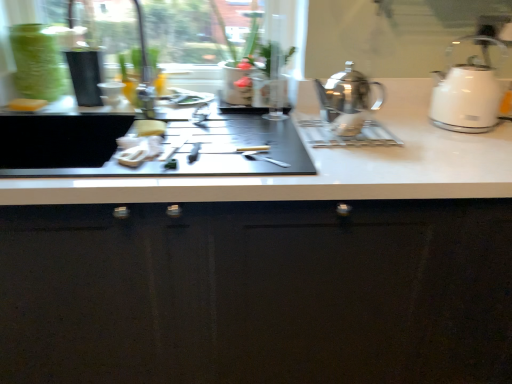
The height and width of the screenshot is (384, 512). Describe the element at coordinates (467, 92) in the screenshot. I see `white glossy kettle at right, which is the second kettle in left-to-right order` at that location.

The height and width of the screenshot is (384, 512). I want to click on shiny metallic kettle at center, which appears as the first kettle when viewed from the left, so click(347, 100).

The height and width of the screenshot is (384, 512). I want to click on glossy black cabinet at center, so click(257, 293).

You are a GUI agent. You are given a task and a screenshot of the screen. Output one action in this format:
    pyautogui.click(x=<x>, y=<y>)
    Task: Click on the white matte sponge at left, which is the 1th food in left-to-right order
    This screenshot has height=384, width=512.
    Given the screenshot: What is the action you would take?
    click(x=26, y=104)

Between point (479, 209) and point (19, 104), which one is positioned behind?

Positioned behind is point (19, 104).

Considering the relative sizes of glossy black cabinet at center and white matte sponge at left, which is counted as the first food, starting from the top, in the image provided, is glossy black cabinet at center thinner than white matte sponge at left, which is counted as the first food, starting from the top,?

No, glossy black cabinet at center is not thinner than white matte sponge at left, which is counted as the first food, starting from the top.

Is glossy black cabinet at center directly adjacent to white matte sponge at left, which is counted as the first food, starting from the top?

No, glossy black cabinet at center is not touching white matte sponge at left, which is counted as the first food, starting from the top.

Which is more to the right, glossy black cabinet at center or white matte sponge at left, which is counted as the first food, starting from the top?

Positioned to the right is glossy black cabinet at center.

Which point is more distant from viewer, [251,10] or [135,141]?

The point [251,10] is behind.

From a real-world perspective, is green matte plant at center physically located above or below white fabric napkin at center, which appears as the 3th food when viewed from the left?

From a real-world perspective, green matte plant at center is physically above white fabric napkin at center, which appears as the 3th food when viewed from the left.

Considering the sizes of green matte plant at center and white fabric napkin at center, which is the first food from right to left, in the image, is green matte plant at center wider or thinner than white fabric napkin at center, which is the first food from right to left,?

Clearly, green matte plant at center has more width compared to white fabric napkin at center, which is the first food from right to left.

Considering the positions of objects white glossy kettle at right, acting as the 1th kettle starting from the right, and yellow sponge at center, acting as the 2th food starting from the bottom, in the image provided, who is in front, white glossy kettle at right, acting as the 1th kettle starting from the right, or yellow sponge at center, acting as the 2th food starting from the bottom,?

Positioned in front is white glossy kettle at right, acting as the 1th kettle starting from the right.

From the image's perspective, which one is positioned lower, white glossy kettle at right, acting as the 1th kettle starting from the right, or yellow sponge at center, arranged as the 2th food when viewed from the top?

yellow sponge at center, arranged as the 2th food when viewed from the top, appears lower in the image.

Which of these two, white glossy kettle at right, acting as the 1th kettle starting from the right, or yellow sponge at center, the 2th food from the back, is wider?

white glossy kettle at right, acting as the 1th kettle starting from the right.

From the image's perspective, is white matte sponge at left, which is counted as the first food, starting from the top, on green matte plant at center?

No.

In the scene shown: How many degrees apart are the facing directions of white matte sponge at left, which ranks as the 1th food in back-to-front order, and green matte plant at center?

white matte sponge at left, which ranks as the 1th food in back-to-front order, and green matte plant at center are facing 16.2 degrees away from each other.

Between white matte sponge at left, which ranks as the 1th food in back-to-front order, and green matte plant at center, which one appears on the right side from the viewer's perspective?

green matte plant at center.

Is white matte sponge at left, which is counted as the first food, starting from the top, aimed at green matte plant at center?

No, white matte sponge at left, which is counted as the first food, starting from the top, is not aimed at green matte plant at center.

Looking at the image, does white fabric napkin at center, which is the first food from right to left, seem bigger or smaller compared to white matte sponge at left, which is the 1th food in left-to-right order?

white fabric napkin at center, which is the first food from right to left, is bigger than white matte sponge at left, which is the 1th food in left-to-right order.

How many degrees apart are the facing directions of white fabric napkin at center, which is the first food from right to left, and white matte sponge at left, which ranks as the 1th food in back-to-front order?

They differ by 14 degrees in their facing directions.

Is white fabric napkin at center, marked as the 1th food in a bottom-to-top arrangement, beside white matte sponge at left, which is the third food from bottom to top?

There is a gap between white fabric napkin at center, marked as the 1th food in a bottom-to-top arrangement, and white matte sponge at left, which is the third food from bottom to top.

Is white fabric napkin at center, which is the first food from right to left, taller or shorter than white matte sponge at left, which ranks as the 1th food in back-to-front order?

Considering their sizes, white fabric napkin at center, which is the first food from right to left, has less height than white matte sponge at left, which ranks as the 1th food in back-to-front order.

Which object is more forward, green matte plant at center or shiny metallic kettle at center, which appears as the first kettle when viewed from the left?

Positioned in front is shiny metallic kettle at center, which appears as the first kettle when viewed from the left.

Is green matte plant at center thinner than shiny metallic kettle at center, which appears as the first kettle when viewed from the left?

In fact, green matte plant at center might be wider than shiny metallic kettle at center, which appears as the first kettle when viewed from the left.

From a real-world perspective, between green matte plant at center and shiny metallic kettle at center, the second kettle when ordered from right to left, who is vertically higher?

In real-world perspective, green matte plant at center is above.

Can you tell me how much green matte plant at center and shiny metallic kettle at center, which appears as the first kettle when viewed from the left, differ in facing direction?

0.979 degrees.

Is yellow sponge at center, acting as the 2th food starting from the bottom, not inside white fabric napkin at center, placed as the third food when sorted from back to front?

Yes, yellow sponge at center, acting as the 2th food starting from the bottom, is located beyond the bounds of white fabric napkin at center, placed as the third food when sorted from back to front.

Is yellow sponge at center, which ranks as the second food in front-to-back order, oriented away from white fabric napkin at center, the 1th food from the front?

No.

In the scene shown: Can you tell me how much yellow sponge at center, the 2th food from the back, and white fabric napkin at center, arranged as the third food when viewed from the top, differ in facing direction?

9.41 degrees.

Locate an element on the screen. The height and width of the screenshot is (384, 512). the 3rd food positioned above the glossy black cabinet at center (from the image's perspective) is located at coordinates (26, 104).

Find the location of a particular element. The width and height of the screenshot is (512, 384). the 1st food to the left when counting from the green matte plant at center is located at coordinates click(x=140, y=151).

From the image, which object appears to be nearer to white glossy kettle at right, acting as the 1th kettle starting from the right, glossy black cabinet at center or white matte sponge at left, acting as the third food starting from the right?

glossy black cabinet at center is closer to white glossy kettle at right, acting as the 1th kettle starting from the right.

When comparing their distances from green matte plant at center, does shiny metallic kettle at center, which appears as the first kettle when viewed from the left, or white matte sponge at left, which is the third food from bottom to top, seem further?

Among the two, white matte sponge at left, which is the third food from bottom to top, is located further to green matte plant at center.

Which object lies nearer to the anchor point green matte plant at center, shiny metallic kettle at center, which appears as the first kettle when viewed from the left, or white glossy kettle at right, acting as the 1th kettle starting from the right?

The object closer to green matte plant at center is shiny metallic kettle at center, which appears as the first kettle when viewed from the left.

Estimate the real-world distances between objects in this image. Which object is further from white matte sponge at left, which ranks as the 1th food in back-to-front order, shiny metallic kettle at center, which appears as the first kettle when viewed from the left, or white fabric napkin at center, which is the first food from right to left?

shiny metallic kettle at center, which appears as the first kettle when viewed from the left, is positioned further to the anchor white matte sponge at left, which ranks as the 1th food in back-to-front order.

When comparing their distances from green matte plant at center, does white fabric napkin at center, which is the first food from right to left, or white glossy kettle at right, acting as the 1th kettle starting from the right, seem closer?

Among the two, white fabric napkin at center, which is the first food from right to left, is located nearer to green matte plant at center.

Looking at the image, which one is located closer to yellow sponge at center, the 2th food viewed from the left, white fabric napkin at center, which is the first food from right to left, or green matte plant at center?

The object closer to yellow sponge at center, the 2th food viewed from the left, is white fabric napkin at center, which is the first food from right to left.

Estimate the real-world distances between objects in this image. Which object is closer to white glossy kettle at right, which is the second kettle in left-to-right order, green matte plant at center or shiny metallic kettle at center, the second kettle when ordered from right to left?

shiny metallic kettle at center, the second kettle when ordered from right to left, is closer to white glossy kettle at right, which is the second kettle in left-to-right order.

When comparing their distances from shiny metallic kettle at center, which appears as the first kettle when viewed from the left, does green matte plant at center or white matte sponge at left, which is counted as the first food, starting from the top, seem further?

Based on the image, white matte sponge at left, which is counted as the first food, starting from the top, appears to be further to shiny metallic kettle at center, which appears as the first kettle when viewed from the left.

Where is `food that lies between yellow sponge at center, which ranks as the second food in front-to-back order, and glossy black cabinet at center from top to bottom`? Image resolution: width=512 pixels, height=384 pixels. food that lies between yellow sponge at center, which ranks as the second food in front-to-back order, and glossy black cabinet at center from top to bottom is located at coordinates (140, 151).

This screenshot has height=384, width=512. I want to click on cabinetry located between white fabric napkin at center, placed as the third food when sorted from back to front, and white glossy kettle at right, which is the second kettle in left-to-right order, in the left-right direction, so click(x=257, y=293).

Locate an element on the screen. The height and width of the screenshot is (384, 512). plant situated between white matte sponge at left, which is the third food from bottom to top, and glossy black cabinet at center from left to right is located at coordinates (251, 35).

What are the coordinates of `food between yellow sponge at center, marked as the 2th food in a right-to-left arrangement, and white glossy kettle at right, which is the second kettle in left-to-right order` in the screenshot? It's located at (140, 151).